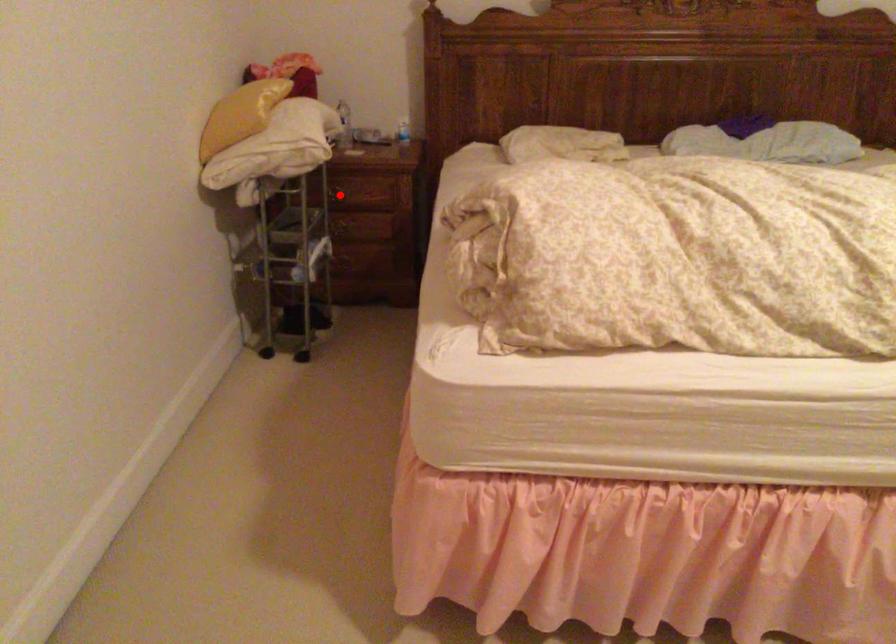
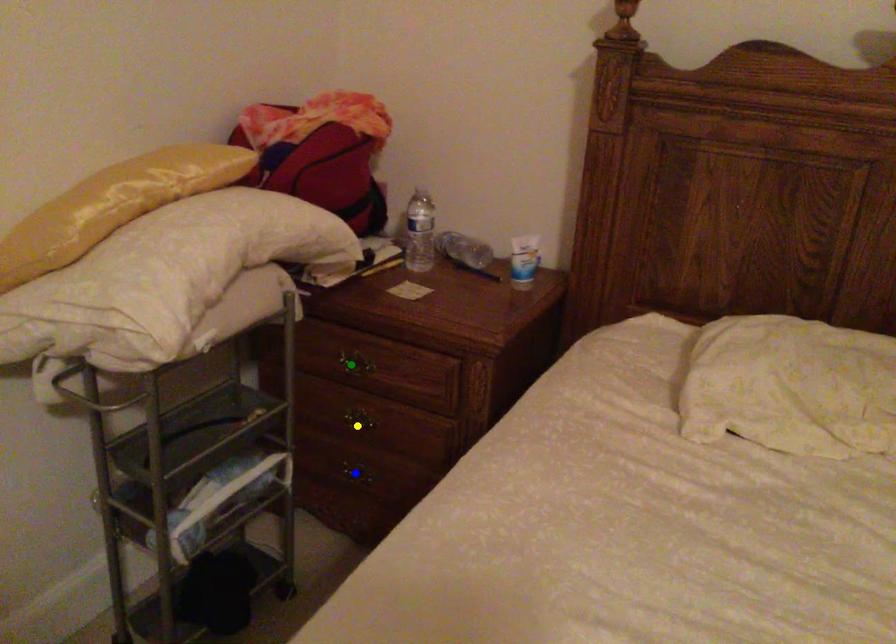
Question: I am providing you with two images of the same scene from different viewpoints. A red point is marked on the first image. You are given multiple points on the second image. Which mark in image 2 goes with the point in image 1?

Choices:
 (A) yellow point
 (B) blue point
 (C) green point

Answer: (C)